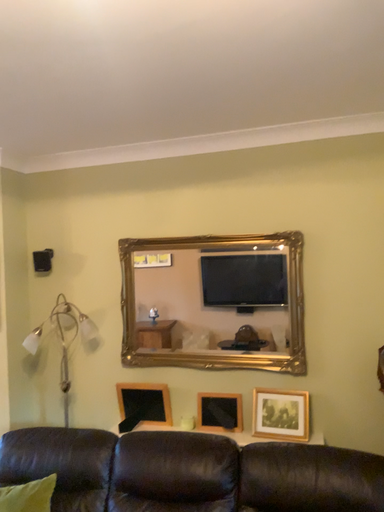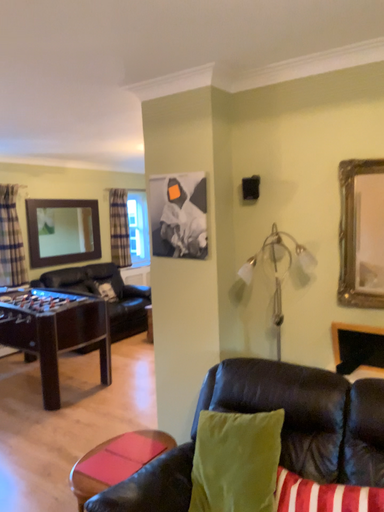
Question: Which way did the camera rotate in the video?

Choices:
 (A) rotated right
 (B) rotated left

Answer: (B)